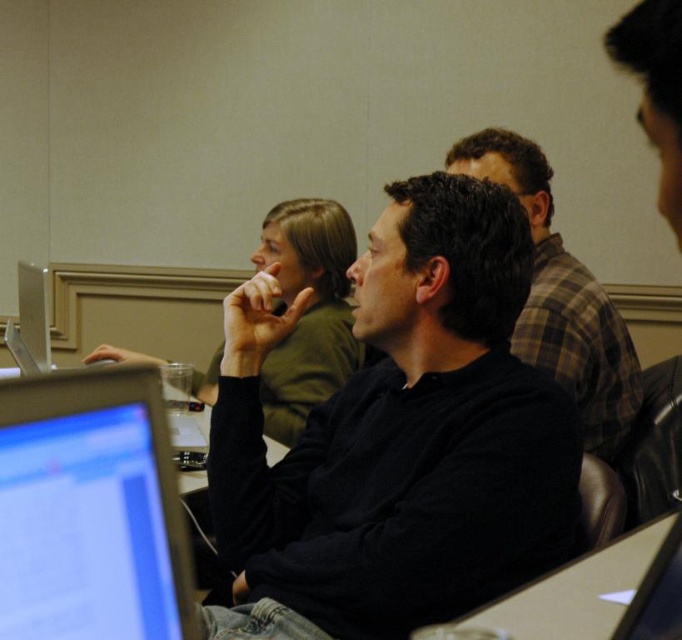
Who is more forward, (170, 589) or (593, 403)?

Point (170, 589)

At what (x,y) coordinates should I click in order to perform the action: click on matte black monitor at lower left. Please return your answer as a coordinate pair (x, y). The width and height of the screenshot is (682, 640). Looking at the image, I should click on (89, 509).

Does black matte shirt at center appear on the left side of matte black monitor at lower left?

No, black matte shirt at center is not to the left of matte black monitor at lower left.

Who is more forward, (228, 420) or (5, 476)?

Point (5, 476) is in front.

Locate an element on the screen. The height and width of the screenshot is (640, 682). black matte shirt at center is located at coordinates (x=398, y=436).

Is black matte shirt at center above plaid fabric shirt at upper center?

Actually, black matte shirt at center is below plaid fabric shirt at upper center.

The width and height of the screenshot is (682, 640). In order to click on black matte shirt at center in this screenshot , I will do `click(398, 436)`.

This screenshot has width=682, height=640. Find the location of `black matte shirt at center`. black matte shirt at center is located at coordinates (398, 436).

Where is `black matte shirt at center`? This screenshot has width=682, height=640. black matte shirt at center is located at coordinates click(x=398, y=436).